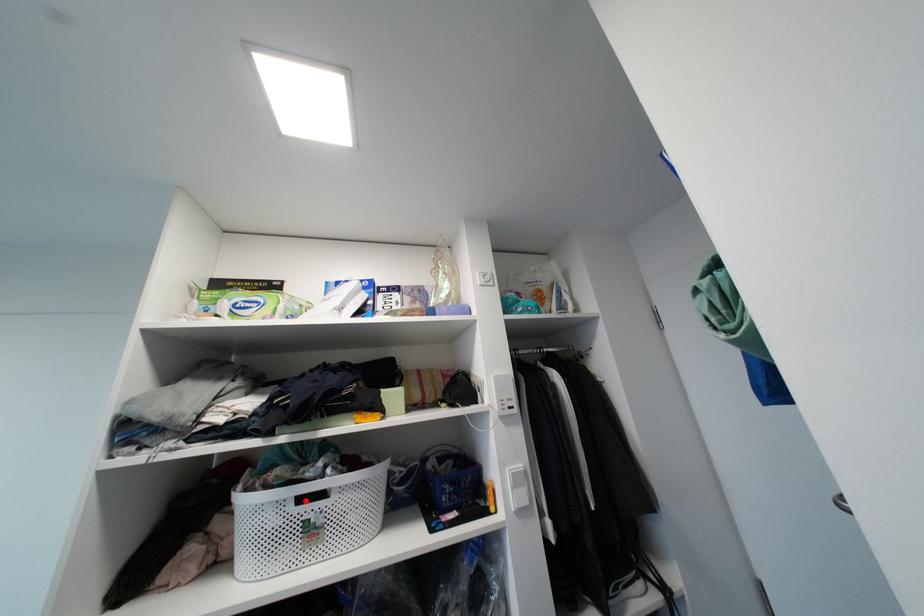
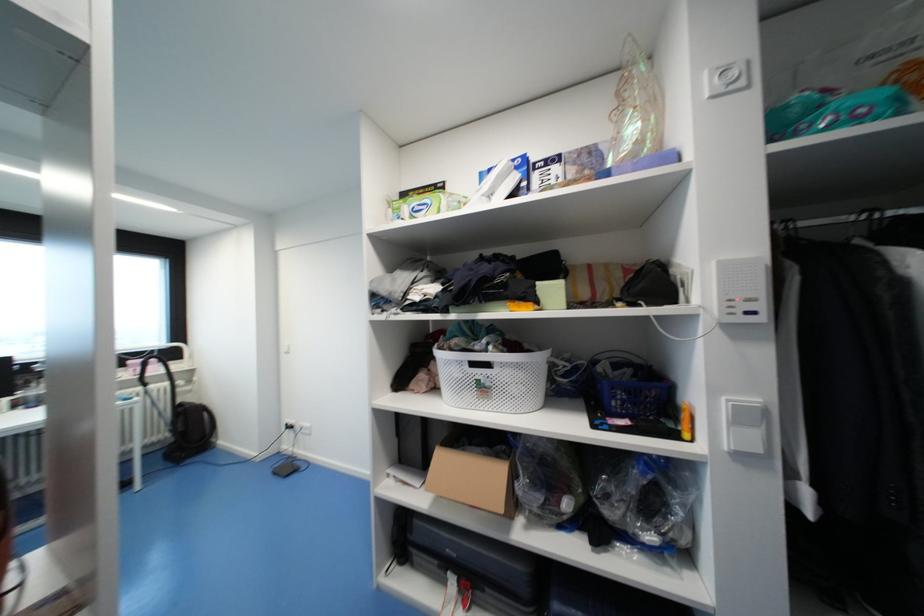
Question: I am providing you with two images of the same scene from different viewpoints. A red point is marked on the first image. At the location where the point appears in image 1, is it still visible in image 2?

Choices:
 (A) Yes
 (B) No

Answer: (A)